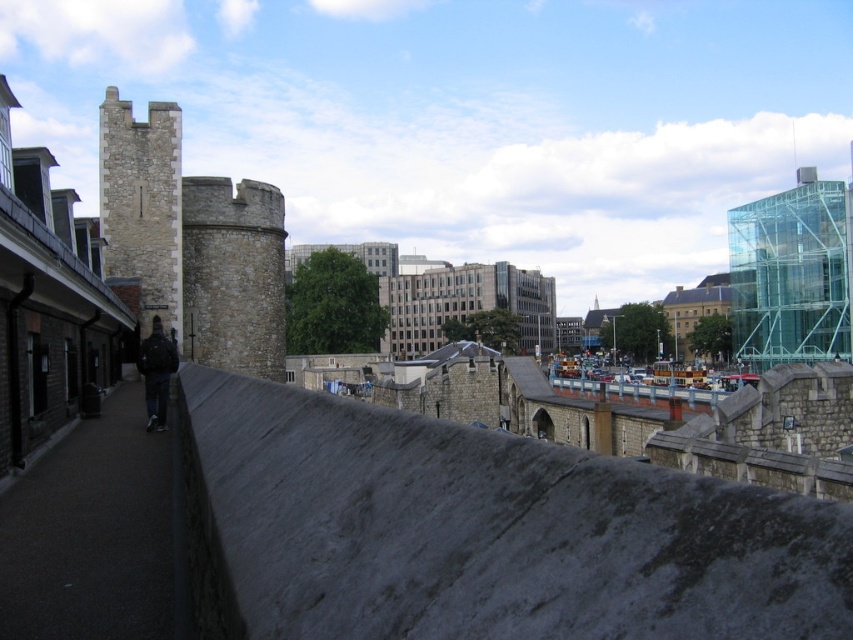
From the picture: You are standing on the dark gray concrete sidewalk at lower left and want to take a photo of the stone tower at left. Which object should you focus on first to ensure both are in the frame?

Since the dark gray concrete sidewalk at lower left occupies less space than the stone tower at left, you should focus on the stone tower at left first to ensure both fit in the frame.

You are standing on the historic stone walkway and want to take a photo of the point at coordinates (85, 433). If your camera has a maximum focus range of 50 meters, will it be able to focus on that point?

The point at coordinates (85, 433) is 50.59 meters away from the camera. Since the camera can only focus up to 50 meters, it will not be able to focus on that point.

You are standing on the dark gray concrete sidewalk at lower left and want to reach the dark blue jacket at center. Which direction should you move to get closer?

The dark gray concrete sidewalk at lower left is shorter than dark blue jacket at center, so you should move towards the center direction to get closer to the dark blue jacket at center.